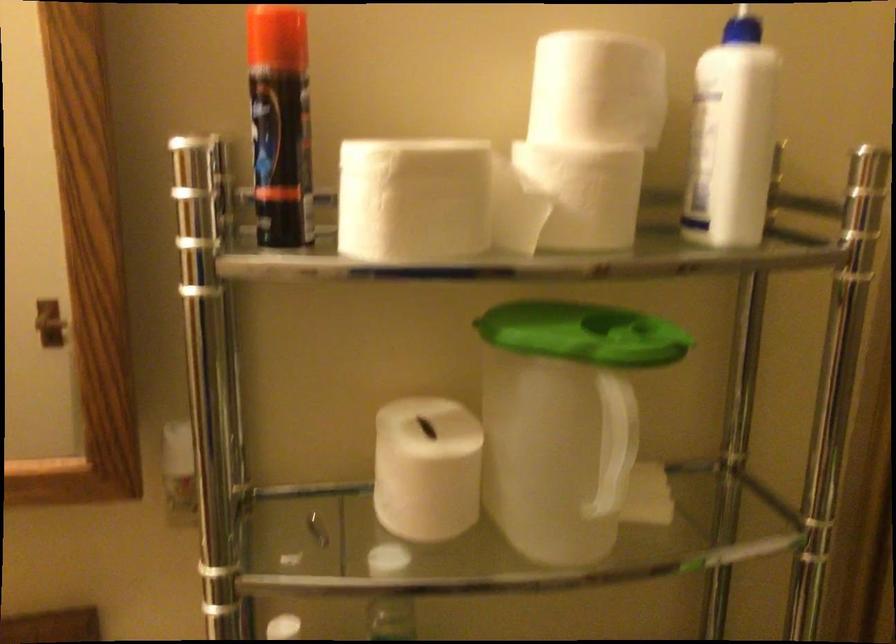
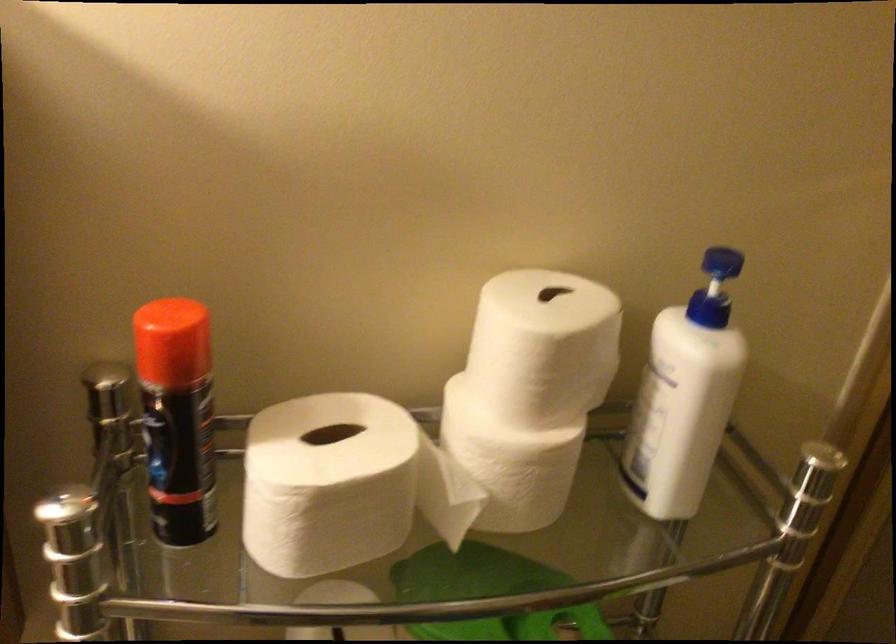
Question: In a continuous first-person perspective shot, in which direction is the camera moving?

Choices:
 (A) Left
 (B) Right
 (C) Forward
 (D) Backward

Answer: (C)